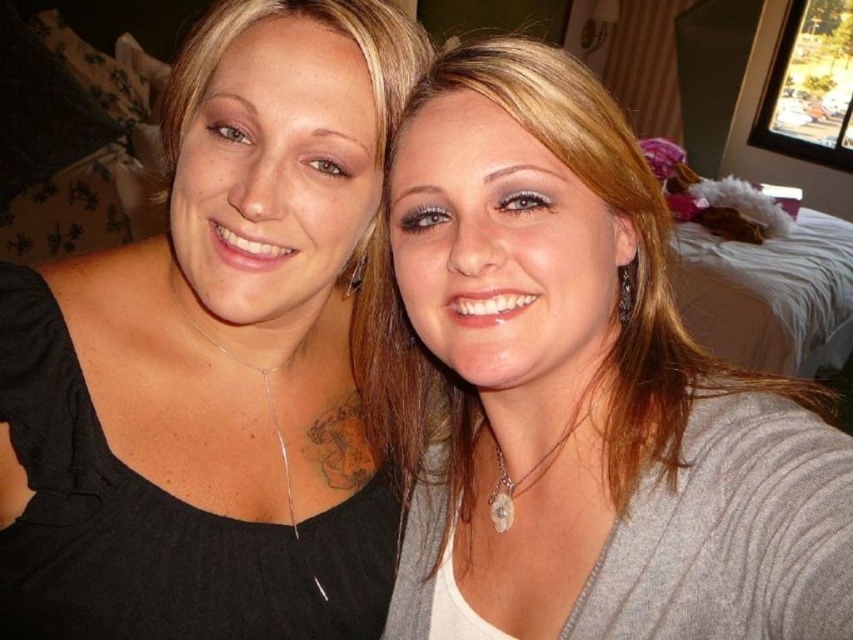
Which is more to the left, black matte shirt at left or matte gray sweater at center?

From the viewer's perspective, black matte shirt at left appears more on the left side.

Is point (107, 602) farther from viewer compared to point (473, 96)?

That is True.

Measure the distance between black matte shirt at left and camera.

The distance of black matte shirt at left from camera is 52.80 centimeters.

Identify the location of black matte shirt at left. This screenshot has width=853, height=640. (218, 358).